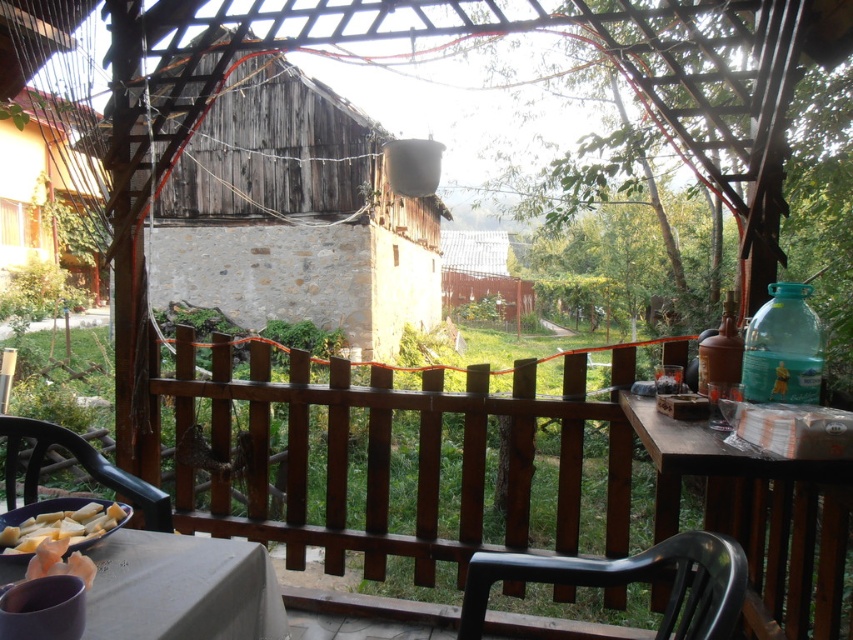
Question: Is weathered wood hut at center positioned behind transparent plastic bottle at right?

Choices:
 (A) no
 (B) yes

Answer: (B)

Question: Which point is farther to the camera?

Choices:
 (A) weathered wood hut at center
 (B) brown wooden table at right

Answer: (A)

Question: Does wooden hut at left have a greater width compared to black plastic chair at lower right?

Choices:
 (A) yes
 (B) no

Answer: (A)

Question: Which point is farther to the camera?

Choices:
 (A) transparent plastic bottle at right
 (B) white fabric table at lower left
 (C) wooden hut at left

Answer: (C)

Question: Which object is closer to the camera taking this photo?

Choices:
 (A) yellowish matte cheese at lower left
 (B) wooden hut at left
 (C) brown wooden fence at center
 (D) weathered wood hut at center

Answer: (C)

Question: Is wooden hut at left above black plastic chair at lower left?

Choices:
 (A) yes
 (B) no

Answer: (A)